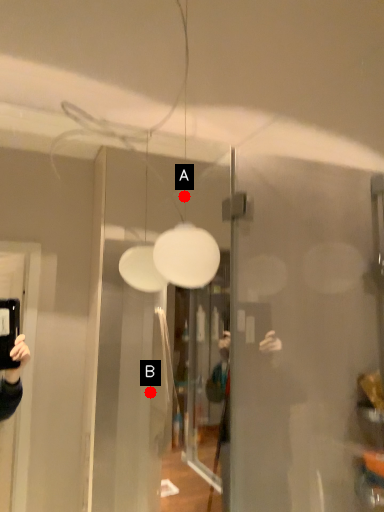
Question: Two points are circled on the image, labeled by A and B beside each circle. Which point appears farthest from the camera in this image?

Choices:
 (A) A is further
 (B) B is further

Answer: (A)